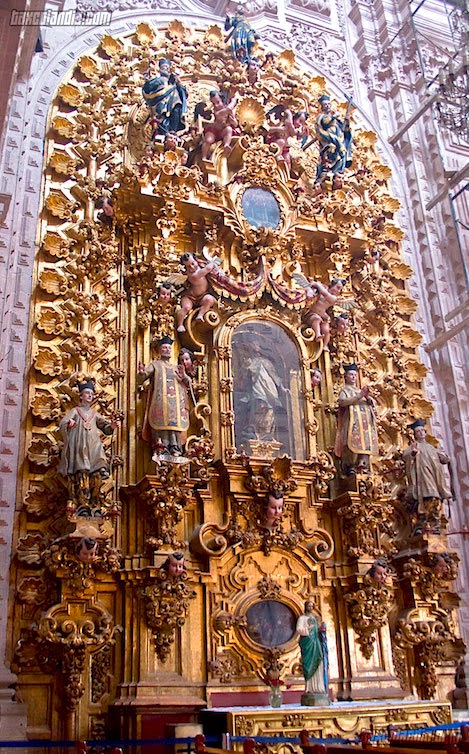
Find the location of a particular element. altar is located at coordinates (355, 728).